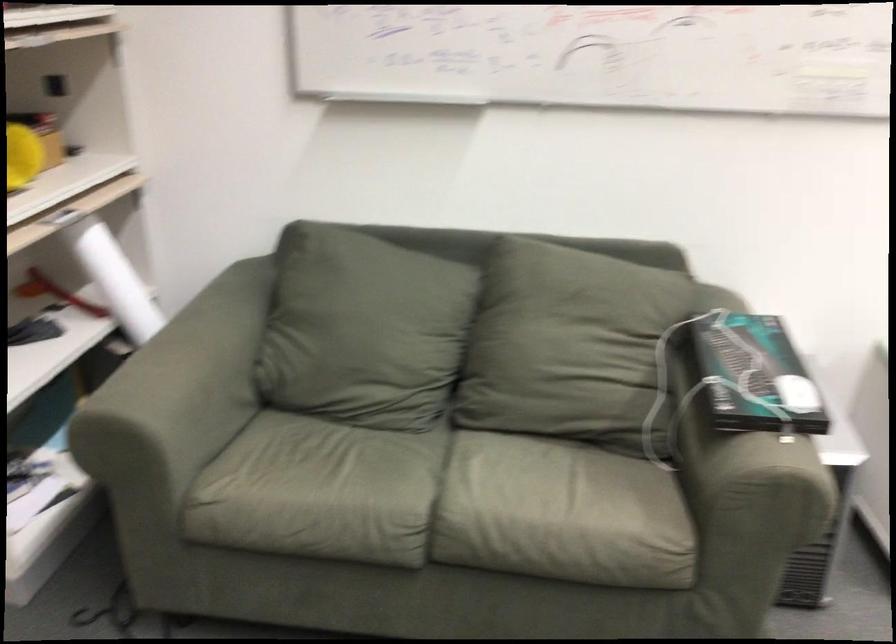
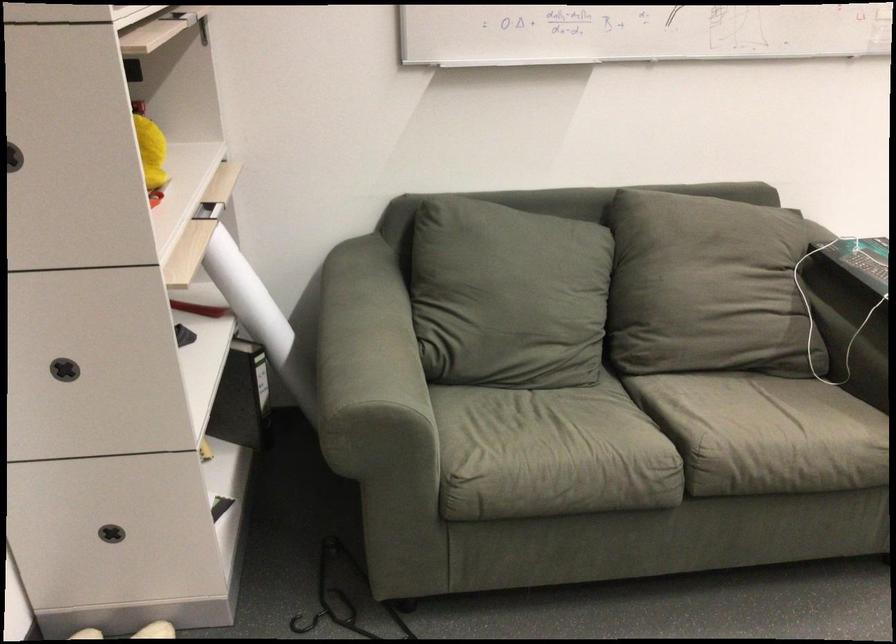
The point at (131, 303) is marked in the first image. Where is the corresponding point in the second image?

(247, 296)